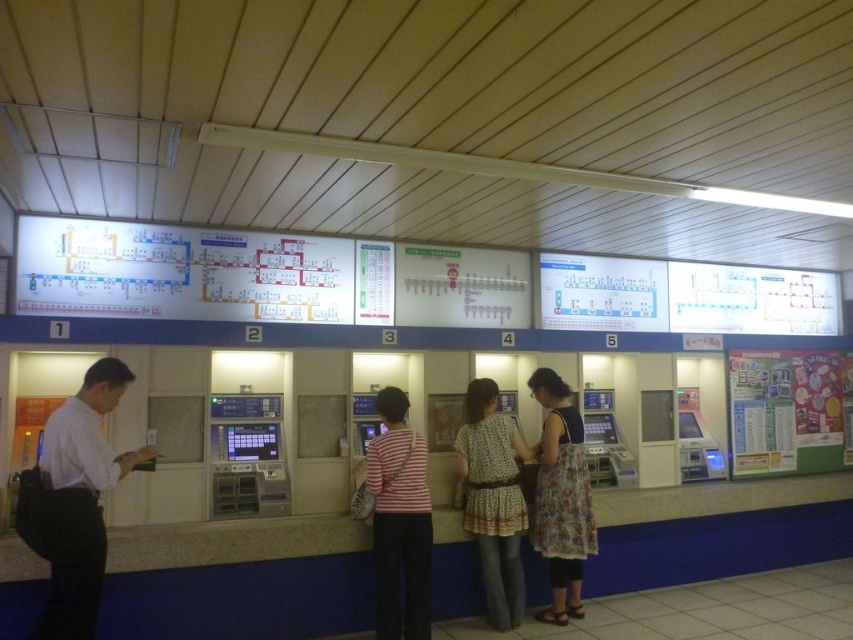
Does point (410, 524) lie behind point (575, 541)?

No, (410, 524) is in front of (575, 541).

Is striped cotton shirt at center to the right of floral dress at center from the viewer's perspective?

In fact, striped cotton shirt at center is to the left of floral dress at center.

Is point (387, 608) behind point (569, 397)?

No, (387, 608) is in front of (569, 397).

Where is `striped cotton shirt at center`? striped cotton shirt at center is located at coordinates (399, 522).

Which is more to the left, striped cotton shirt at center or dotted fabric blouse at center?

striped cotton shirt at center is more to the left.

The image size is (853, 640). Describe the element at coordinates (399, 522) in the screenshot. I see `striped cotton shirt at center` at that location.

Identify the location of striped cotton shirt at center. The image size is (853, 640). pyautogui.click(x=399, y=522).

Is white shirt at left bigger than dotted fabric blouse at center?

Incorrect, white shirt at left is not larger than dotted fabric blouse at center.

Can you confirm if white shirt at left is positioned above dotted fabric blouse at center?

Correct, white shirt at left is located above dotted fabric blouse at center.

You are a GUI agent. You are given a task and a screenshot of the screen. Output one action in this format:
    pyautogui.click(x=<x>, y=<y>)
    Task: Click on the white shirt at left
    This screenshot has height=640, width=853.
    Given the screenshot: What is the action you would take?
    80,499

This screenshot has height=640, width=853. Identify the location of white shirt at left. (80, 499).